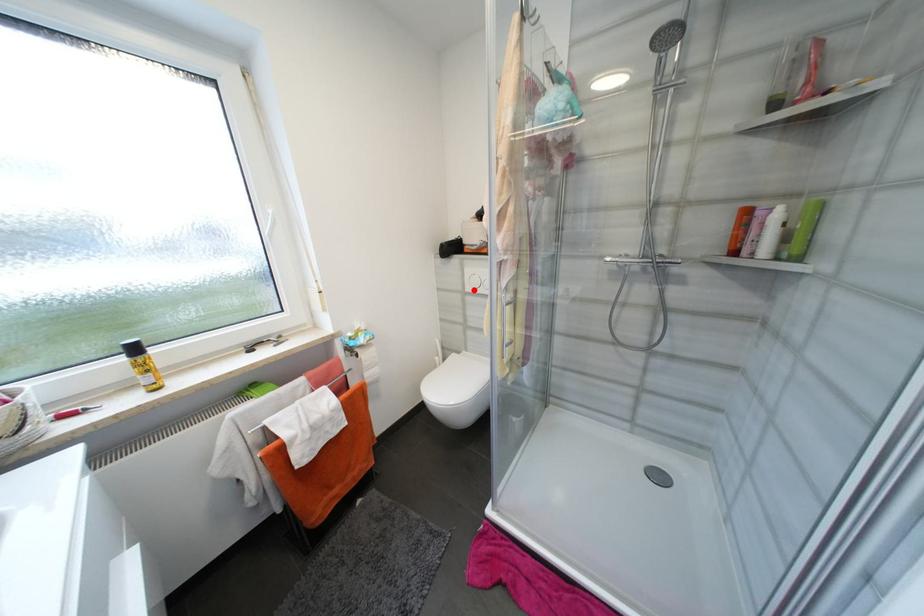
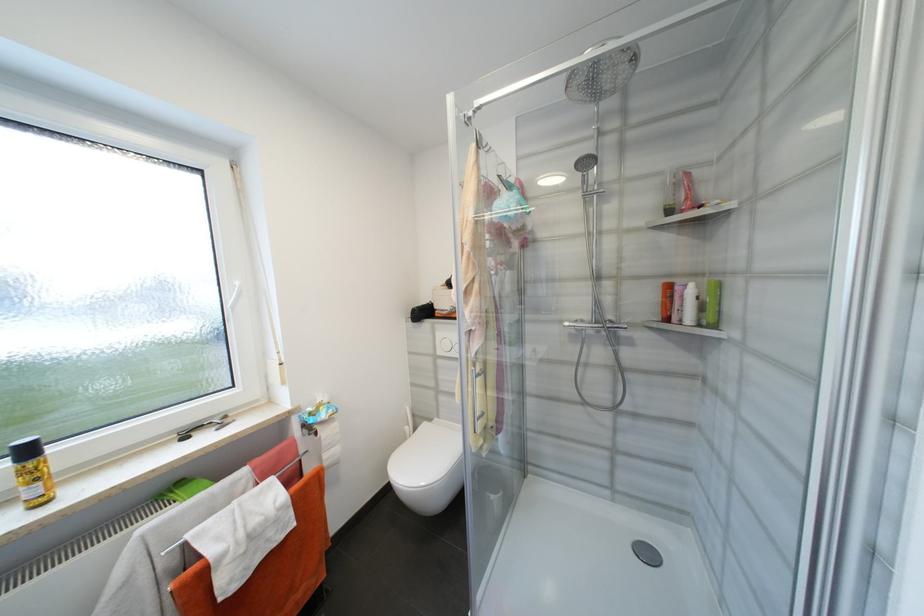
Question: I am providing you with two images of the same scene from different viewpoints. Given a red point in image1, look at the same physical point in image2. Is it:

Choices:
 (A) Closer to the viewpoint
 (B) Farther from the viewpoint

Answer: (B)